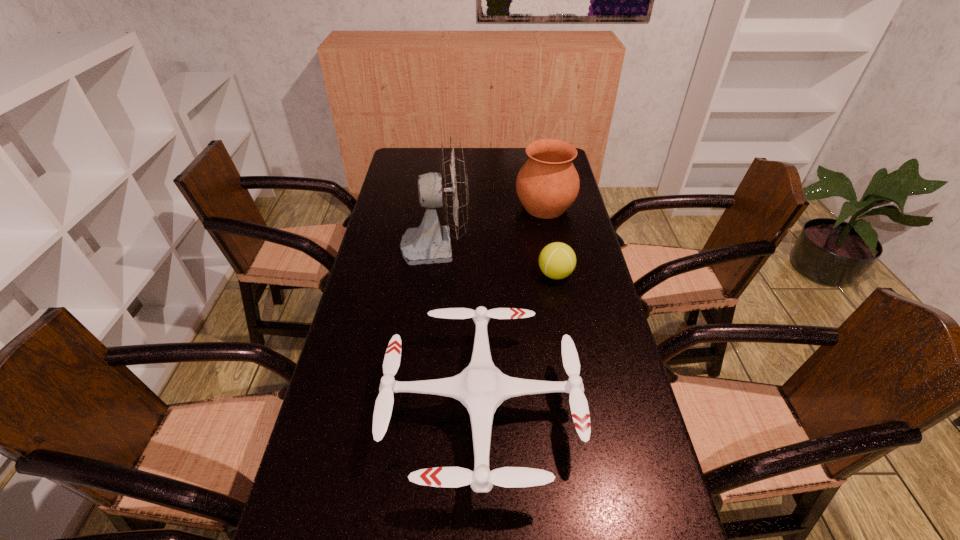
At what (x,y) coordinates should I click in order to perform the action: click on free point between the tennis ball and the drone. Please return your answer as a coordinate pair (x, y). This screenshot has width=960, height=540. Looking at the image, I should click on (518, 341).

Find the location of a particular element. free space between the tennis ball and the pottery is located at coordinates (550, 241).

Where is `blank region between the pottery and the tallest object`? This screenshot has width=960, height=540. blank region between the pottery and the tallest object is located at coordinates (491, 226).

I want to click on unoccupied area between the tennis ball and the drone, so click(518, 341).

You are a GUI agent. You are given a task and a screenshot of the screen. Output one action in this format:
    pyautogui.click(x=<x>, y=<y>)
    Task: Click on the vacant space in between the tennis ball and the tallest object
    Image resolution: width=960 pixels, height=540 pixels.
    Given the screenshot: What is the action you would take?
    pos(495,260)

Identify which object is located as the third nearest to the second tallest object. Please provide its 2D coordinates. Your answer should be formatted as a tuple, i.e. [(x, y)], where the tuple contains the x and y coordinates of a point satisfying the conditions above.

[(481, 387)]

Select which object appears as the second closest to the tallest object. Please provide its 2D coordinates. Your answer should be formatted as a tuple, i.e. [(x, y)], where the tuple contains the x and y coordinates of a point satisfying the conditions above.

[(557, 260)]

Identify the location of free space that satisfies the following two spatial constraints: 1. in front of the tennis ball to blow air; 2. on the right side of the tallest object. This screenshot has height=540, width=960. (432, 274).

The height and width of the screenshot is (540, 960). I want to click on vacant space that satisfies the following two spatial constraints: 1. in front of the tennis ball to blow air; 2. on the right side of the fan, so click(x=432, y=274).

Locate an element on the screen. The image size is (960, 540). vacant space that satisfies the following two spatial constraints: 1. in front of the fan to blow air; 2. on the back side of the tennis ball is located at coordinates (432, 274).